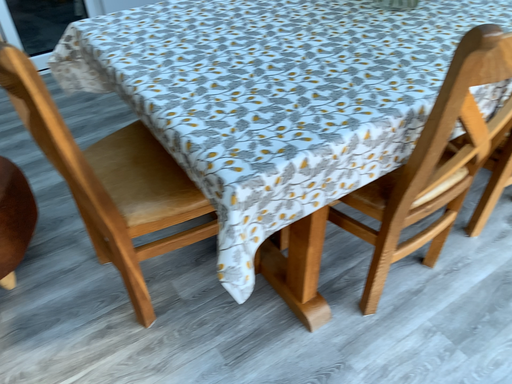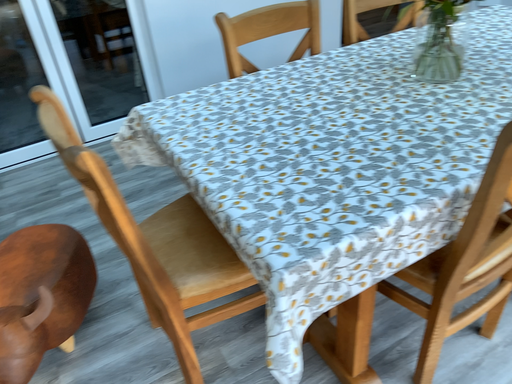
Question: Which way did the camera rotate in the video?

Choices:
 (A) rotated downward
 (B) rotated upward

Answer: (B)